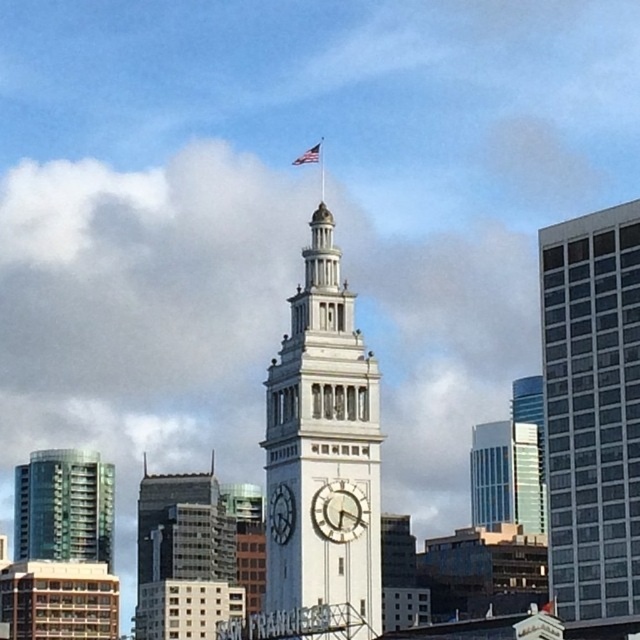
You are an architect analyzing the spatial arrangement of the clock tower and its components. Based on the scene, does the white stone clock tower at center appear to be physically above the gold metallic clock at center?

Yes, the white stone clock tower at center is positioned over the gold metallic clock at center, meaning it appears to be physically above it in the structure.

You are standing at the base of the clock tower and looking towards the city skyline. There are two points marked in the image. One is at coordinates point (x=358, y=333) and the other is at point (x=337, y=529). Which of these two points is closer to you?

Point (x=337, y=529) is closer to you because point (x=358, y=333) is behind point (x=337, y=529).